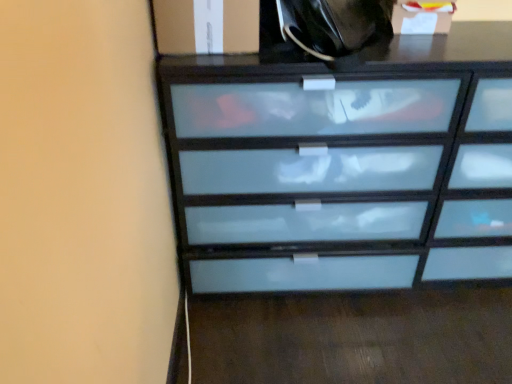
Question: From the image's perspective, is white frosted glass cabinet at upper right, which is the 2th cabinetry from left to right, beneath white frosted glass cabinet at upper left, the second cabinetry when ordered from right to left?

Choices:
 (A) yes
 (B) no

Answer: (B)

Question: Considering the relative sizes of white frosted glass cabinet at upper right, which is the 2th cabinetry from left to right, and white frosted glass cabinet at upper left, placed as the 1th cabinetry when sorted from left to right, in the image provided, is white frosted glass cabinet at upper right, which is the 2th cabinetry from left to right, thinner than white frosted glass cabinet at upper left, placed as the 1th cabinetry when sorted from left to right,?

Choices:
 (A) yes
 (B) no

Answer: (A)

Question: Is white frosted glass cabinet at upper right, positioned as the 1th cabinetry in right-to-left order, at the left side of white frosted glass cabinet at upper left, placed as the 1th cabinetry when sorted from left to right?

Choices:
 (A) no
 (B) yes

Answer: (A)

Question: Is white frosted glass cabinet at upper right, which is the 2th cabinetry from left to right, oriented towards white frosted glass cabinet at upper left, the second cabinetry when ordered from right to left?

Choices:
 (A) no
 (B) yes

Answer: (A)

Question: Is white frosted glass cabinet at upper right, positioned as the 1th cabinetry in right-to-left order, positioned far away from white frosted glass cabinet at upper left, the second cabinetry when ordered from right to left?

Choices:
 (A) yes
 (B) no

Answer: (B)

Question: Based on their sizes in the image, would you say white frosted glass cabinet at upper left, placed as the 1th cabinetry when sorted from left to right, is bigger or smaller than black glossy tote bag at upper center?

Choices:
 (A) small
 (B) big

Answer: (A)

Question: From their relative heights in the image, would you say white frosted glass cabinet at upper left, placed as the 1th cabinetry when sorted from left to right, is taller or shorter than black glossy tote bag at upper center?

Choices:
 (A) short
 (B) tall

Answer: (A)

Question: In terms of width, does white frosted glass cabinet at upper left, the second cabinetry when ordered from right to left, look wider or thinner when compared to black glossy tote bag at upper center?

Choices:
 (A) thin
 (B) wide

Answer: (B)

Question: Relative to black glossy tote bag at upper center, is white frosted glass cabinet at upper left, placed as the 1th cabinetry when sorted from left to right, in front or behind?

Choices:
 (A) behind
 (B) front

Answer: (A)

Question: In terms of height, does frosted glass chest of drawers at center look taller or shorter compared to white frosted glass cabinet at upper right, which is the 2th cabinetry from left to right?

Choices:
 (A) tall
 (B) short

Answer: (A)

Question: From the image's perspective, is frosted glass chest of drawers at center positioned above or below white frosted glass cabinet at upper right, which is the 2th cabinetry from left to right?

Choices:
 (A) above
 (B) below

Answer: (B)

Question: From a real-world perspective, relative to white frosted glass cabinet at upper right, positioned as the 1th cabinetry in right-to-left order, is frosted glass chest of drawers at center vertically above or below?

Choices:
 (A) below
 (B) above

Answer: (A)

Question: Does point (280, 71) appear closer or farther from the camera than point (455, 1)?

Choices:
 (A) farther
 (B) closer

Answer: (B)

Question: Is black glossy tote bag at upper center taller or shorter than white frosted glass cabinet at upper right, which is the 2th cabinetry from left to right?

Choices:
 (A) short
 (B) tall

Answer: (A)

Question: Looking at their shapes, would you say black glossy tote bag at upper center is wider or thinner than white frosted glass cabinet at upper right, which is the 2th cabinetry from left to right?

Choices:
 (A) wide
 (B) thin

Answer: (A)